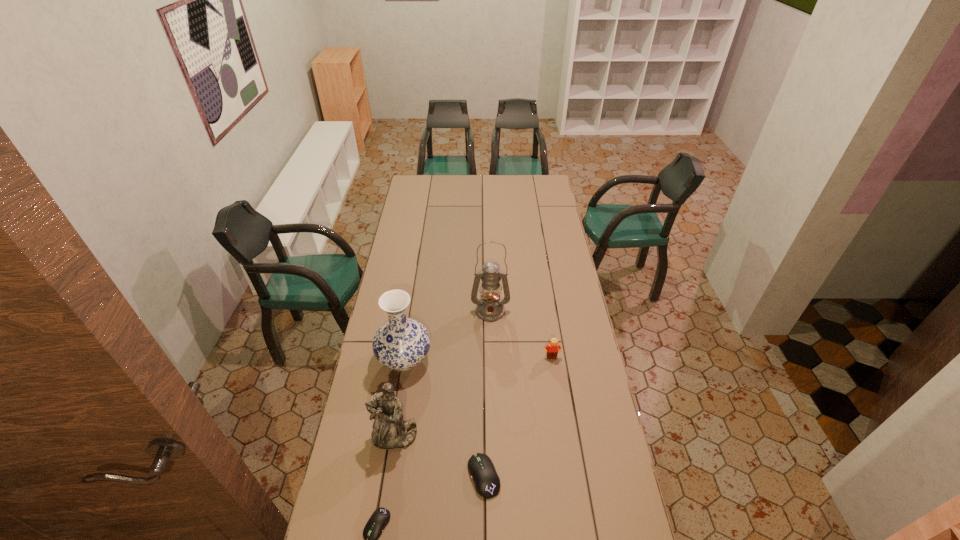
I want to click on free space for a new computer equipment on the right, so click(x=575, y=434).